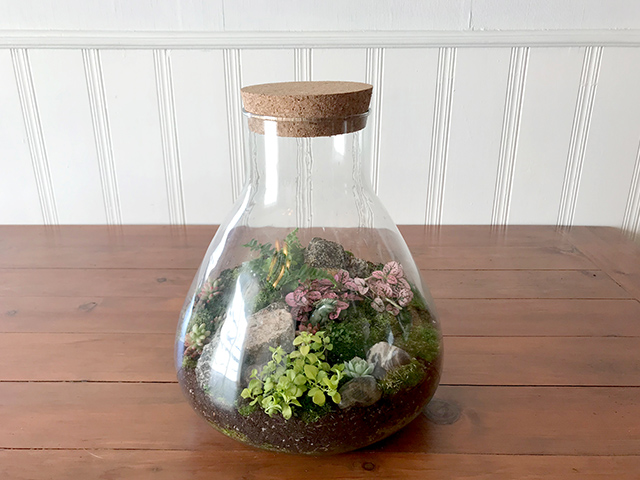
I want to click on white wooden wall, so click(x=467, y=115).